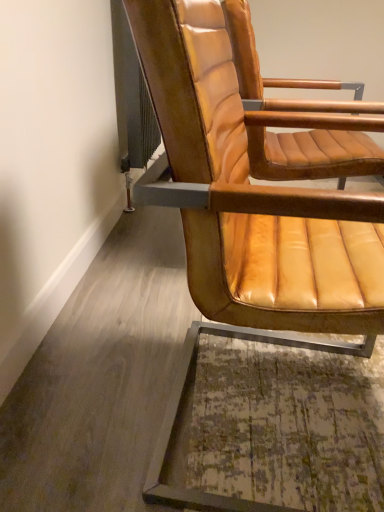
Question: In which direction should I rotate to look at tan leather chair at center, placed as the 1th chair when sorted from back to front?

Choices:
 (A) right
 (B) left

Answer: (A)

Question: From a real-world perspective, is tan leather chair at center, placed as the 1th chair when sorted from back to front, located beneath leather at right, the first chair viewed from the front?

Choices:
 (A) no
 (B) yes

Answer: (A)

Question: Does tan leather chair at center, positioned as the second chair in front-to-back order, come in front of leather at right, which is the 2th chair from back to front?

Choices:
 (A) no
 (B) yes

Answer: (A)

Question: Considering the relative sizes of tan leather chair at center, placed as the 1th chair when sorted from back to front, and leather at right, which is the 2th chair from back to front, in the image provided, is tan leather chair at center, placed as the 1th chair when sorted from back to front, thinner than leather at right, which is the 2th chair from back to front,?

Choices:
 (A) yes
 (B) no

Answer: (B)

Question: Does tan leather chair at center, positioned as the second chair in front-to-back order, have a larger size compared to leather at right, which is the 2th chair from back to front?

Choices:
 (A) no
 (B) yes

Answer: (A)

Question: Does tan leather chair at center, positioned as the second chair in front-to-back order, appear on the left side of leather at right, the first chair viewed from the front?

Choices:
 (A) yes
 (B) no

Answer: (B)

Question: Can you confirm if tan leather chair at center, placed as the 1th chair when sorted from back to front, is taller than leather at right, the first chair viewed from the front?

Choices:
 (A) no
 (B) yes

Answer: (A)

Question: Are leather at right, which is the 2th chair from back to front, and tan leather chair at center, placed as the 1th chair when sorted from back to front, located far from each other?

Choices:
 (A) yes
 (B) no

Answer: (B)

Question: From the image's perspective, is leather at right, the first chair viewed from the front, below tan leather chair at center, positioned as the second chair in front-to-back order?

Choices:
 (A) no
 (B) yes

Answer: (B)

Question: Can you confirm if leather at right, which is the 2th chair from back to front, is thinner than tan leather chair at center, placed as the 1th chair when sorted from back to front?

Choices:
 (A) no
 (B) yes

Answer: (B)

Question: Can you confirm if leather at right, which is the 2th chair from back to front, is bigger than tan leather chair at center, placed as the 1th chair when sorted from back to front?

Choices:
 (A) yes
 (B) no

Answer: (A)

Question: Is leather at right, which is the 2th chair from back to front, not inside tan leather chair at center, positioned as the second chair in front-to-back order?

Choices:
 (A) yes
 (B) no

Answer: (A)

Question: From a real-world perspective, is leather at right, the first chair viewed from the front, positioned over tan leather chair at center, positioned as the second chair in front-to-back order, based on gravity?

Choices:
 (A) yes
 (B) no

Answer: (B)

Question: Considering the positions of tan leather chair at center, positioned as the second chair in front-to-back order, and leather at right, which is the 2th chair from back to front, in the image, is tan leather chair at center, positioned as the second chair in front-to-back order, taller or shorter than leather at right, which is the 2th chair from back to front,?

Choices:
 (A) tall
 (B) short

Answer: (B)